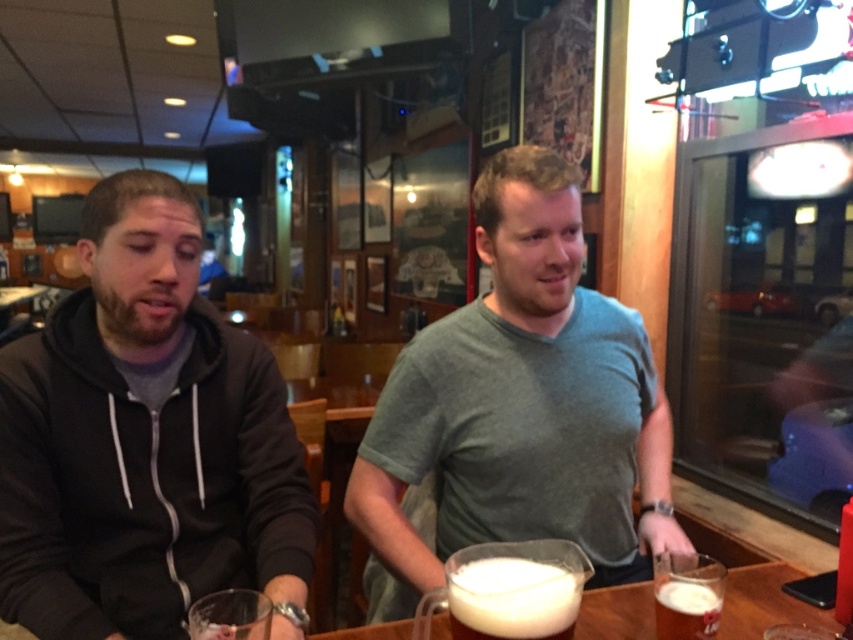
You are a bartender who needs to serve two drinks to customers. The drinks are the white frothy liquid at center and the white frothy foam at lower center. Which drink has a taller height?

The white frothy foam at lower center is taller than the white frothy liquid at center.

You are a waiter in a restaurant. You need to deliver a drink to the customer. The drink has white frothy foam at lower center. Where should you place the drink relative to the gray matte shirt at center?

You should place the drink to the left of the gray matte shirt at center because the gray matte shirt at center is to the right of the white frothy foam at lower center, meaning the foam is already on its left side.

You are standing at the edge of the table and want to place a small object on both the point at (730, 593) and the point at (523, 605). Which point is closer to you?

Point at (730, 593) is closer to you because it is further to the viewer than point at (523, 605).